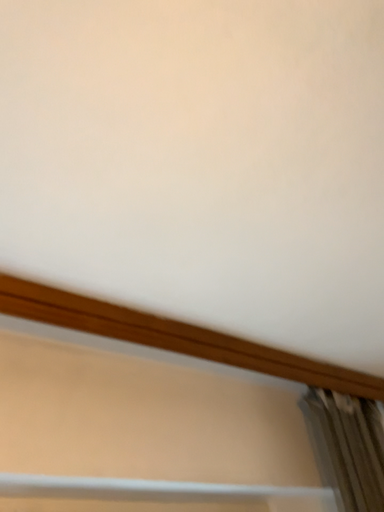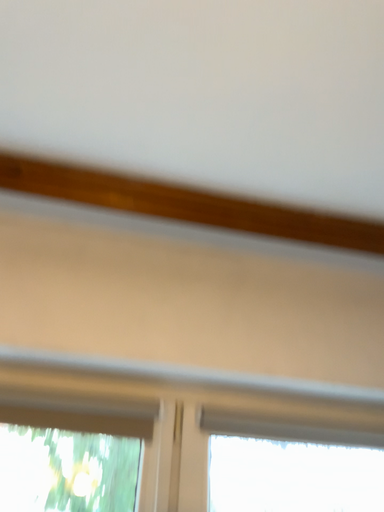
Question: Which way did the camera rotate in the video?

Choices:
 (A) rotated upward
 (B) rotated downward

Answer: (B)